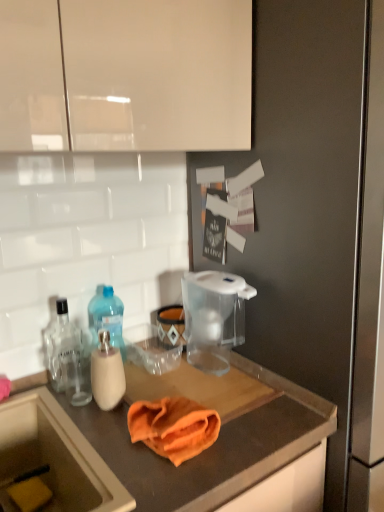
This screenshot has height=512, width=384. Find the location of `vacant area that is situated to the right of clear glass bottle at left, which is the 2th bottle from right to left`. vacant area that is situated to the right of clear glass bottle at left, which is the 2th bottle from right to left is located at coordinates (148, 382).